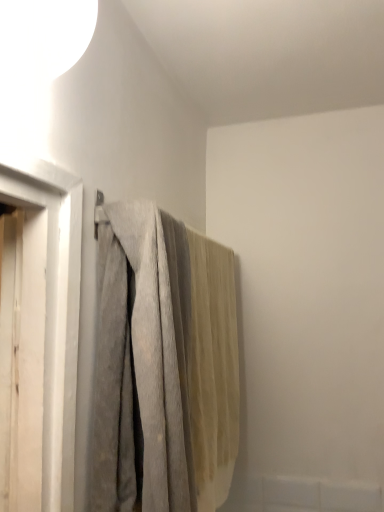
Question: Which is correct: white matte lampshade at upper left is inside gray textured fabric at center, or outside of it?

Choices:
 (A) outside
 (B) inside

Answer: (A)

Question: Considering the positions of white matte lampshade at upper left and gray textured fabric at center in the image, is white matte lampshade at upper left taller or shorter than gray textured fabric at center?

Choices:
 (A) tall
 (B) short

Answer: (B)

Question: Is white matte lampshade at upper left to the left or to the right of gray textured fabric at center in the image?

Choices:
 (A) left
 (B) right

Answer: (A)

Question: From the image's perspective, is gray textured fabric at center above or below white matte lampshade at upper left?

Choices:
 (A) below
 (B) above

Answer: (A)

Question: From a real-world perspective, is gray textured fabric at center above or below white matte lampshade at upper left?

Choices:
 (A) below
 (B) above

Answer: (A)

Question: In terms of height, does gray textured fabric at center look taller or shorter compared to white matte lampshade at upper left?

Choices:
 (A) short
 (B) tall

Answer: (B)

Question: Considering the positions of point (94, 394) and point (33, 138), is point (94, 394) closer or farther from the camera than point (33, 138)?

Choices:
 (A) farther
 (B) closer

Answer: (A)